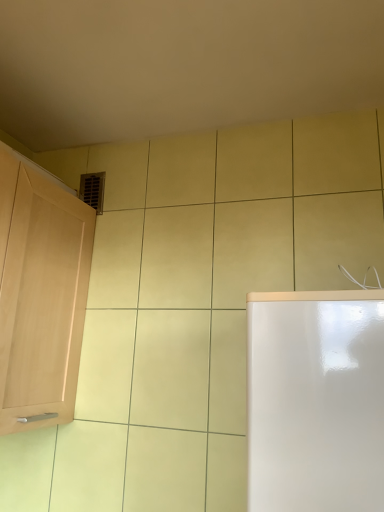
Describe the element at coordinates (40, 295) in the screenshot. I see `light wood cabinet at left` at that location.

Where is `light wood cabinet at left`? light wood cabinet at left is located at coordinates [x=40, y=295].

Locate an element on the screen. Image resolution: width=384 pixels, height=512 pixels. light wood cabinet at left is located at coordinates pos(40,295).